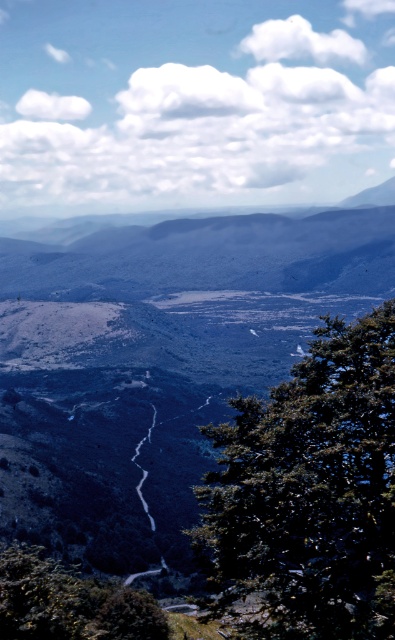
Based on the photo, is green leafy tree at center wider than green leafy tree at lower left?

No.

Does point (314, 376) come behind point (0, 586)?

Yes.

You are a GUI agent. You are given a task and a screenshot of the screen. Output one action in this format:
    pyautogui.click(x=<x>, y=<y>)
    Task: Click on the green leafy tree at center
    
    Given the screenshot: What is the action you would take?
    pyautogui.click(x=310, y=492)